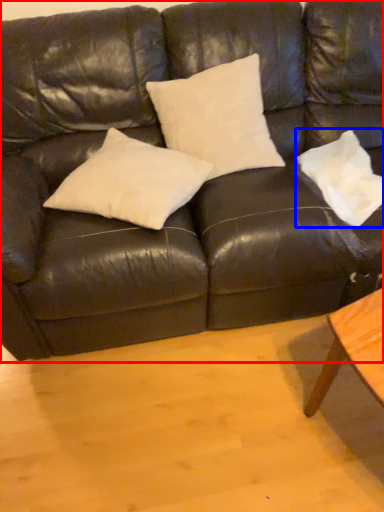
Question: Which object is further to the camera taking this photo, studio couch (highlighted by a red box) or pillow (highlighted by a blue box)?

Choices:
 (A) studio couch
 (B) pillow

Answer: (B)